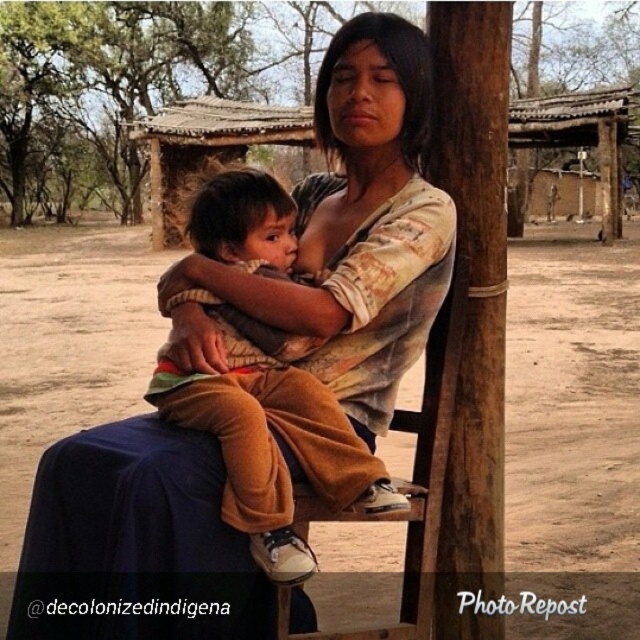
You are a photographer setting up for a family portrait. You want to position the green leafy tree at upper left and the wooden chair at center in your shot. Based on the scene description, which object should be placed further to the left in your composition?

The green leafy tree at upper left should be placed further to the left in your composition because it is positioned to the left of the wooden chair at center according to the description.

You are standing in the outdoor scene and want to place a small flower pot between the two points, point (124, 124) and point (276, 620). Which point should the flower pot be closer to in order to be placed closer to the viewer?

The flower pot should be placed closer to point (124, 124) because it is closer to the viewer compared to point (276, 620).